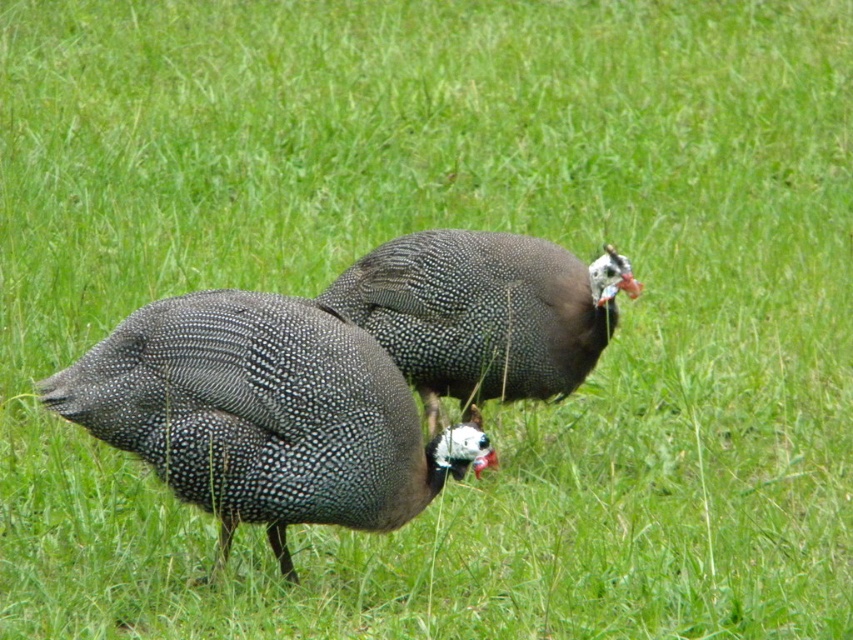
Is point (138, 387) closer to camera compared to point (485, 369)?

Yes, it is in front of point (485, 369).

Which is in front, point (122, 339) or point (529, 284)?

Point (122, 339)

Image resolution: width=853 pixels, height=640 pixels. What are the coordinates of `speckled feathered turkey at center` in the screenshot? It's located at pyautogui.click(x=260, y=413).